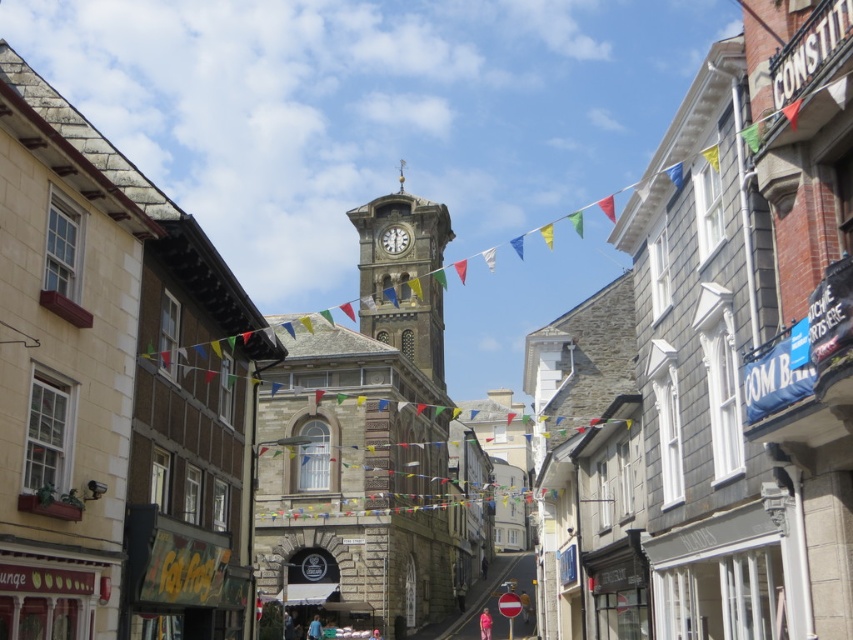
You are a tourist in this historic town and want to take a photo of both the stone clock tower at center and the white stone clock at center. Since you want them both in the frame, which object should you position to the left to include both?

To include both the stone clock tower at center and the white stone clock at center in the frame, you should position the white stone clock at center to the left since the stone clock tower at center is to the right of it.

You are a tourist standing at the entrance of the historic town and see the stone clock tower at center. If you want to take a photo of the tower, will you need to zoom in your camera to capture the entire structure?

The stone clock tower at center is 147.14 meters away from the camera. Since it is quite far away, you would need to zoom in your camera to ensure the entire structure fits within the frame.

You are a tourist standing on the street looking at the stone clock tower at center and the white stone clock at center. Which one appears nearer to you?

The stone clock tower at center is closer to the viewer than the white stone clock at center.